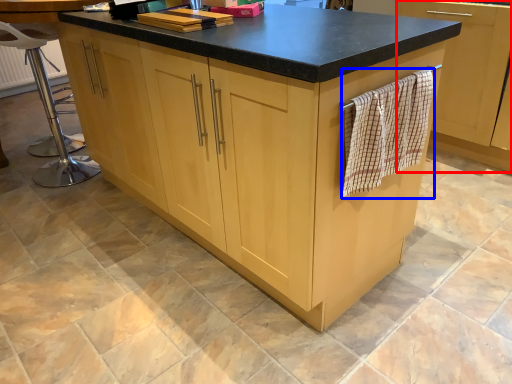
Question: Which point is further to the camera, cabinetry (highlighted by a red box) or bath towel (highlighted by a blue box)?

Choices:
 (A) cabinetry
 (B) bath towel

Answer: (A)